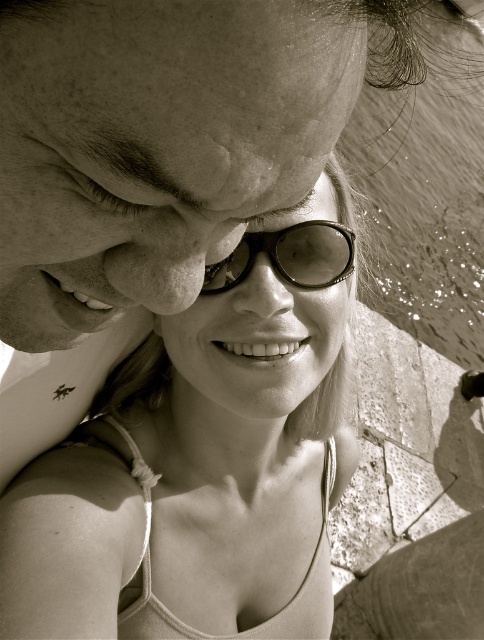
Question: Considering the relative positions of matte black sunglasses at center and metallic reflective sunglasses at center in the image provided, where is matte black sunglasses at center located with respect to metallic reflective sunglasses at center?

Choices:
 (A) left
 (B) right

Answer: (A)

Question: Is matte black sunglasses at center above smooth skin forehead at upper center?

Choices:
 (A) no
 (B) yes

Answer: (A)

Question: Which point is closer to the camera taking this photo?

Choices:
 (A) (336, 262)
 (B) (58, 81)
 (C) (226, 273)

Answer: (B)

Question: Which object is positioned closest to the metallic reflective sunglasses at center?

Choices:
 (A) matte black sunglasses at center
 (B) smooth skin forehead at upper center

Answer: (A)

Question: Which point is farther to the camera?

Choices:
 (A) (47, 16)
 (B) (320, 248)

Answer: (B)

Question: Can you confirm if matte black sunglasses at center is bigger than smooth skin forehead at upper center?

Choices:
 (A) yes
 (B) no

Answer: (A)